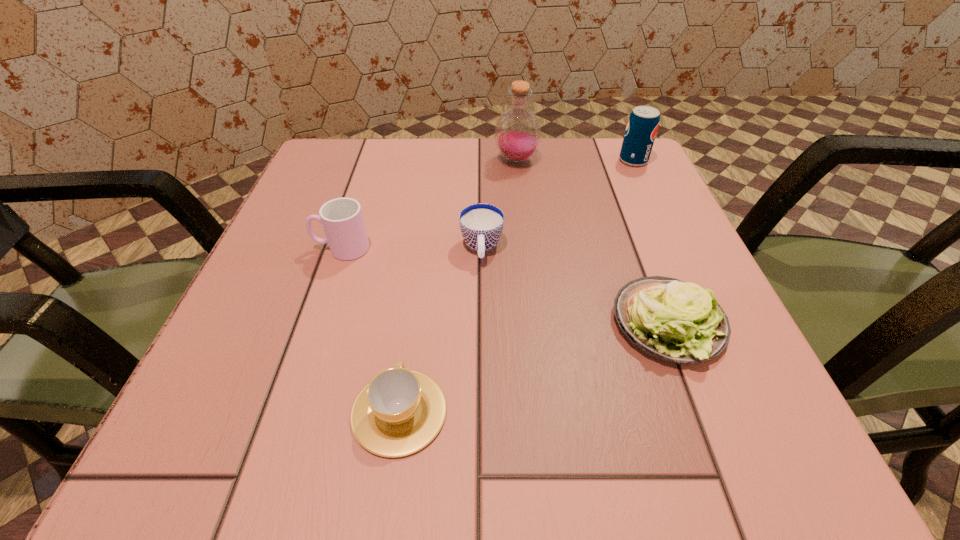
In order to click on bottle in this screenshot , I will do `click(517, 133)`.

Image resolution: width=960 pixels, height=540 pixels. I want to click on pop, so click(x=643, y=122).

At what (x,y) coordinates should I click in order to perform the action: click on the tallest cup. Please return your answer as a coordinate pair (x, y). The image size is (960, 540). Looking at the image, I should click on (342, 219).

Identify the location of the leftmost cup. This screenshot has height=540, width=960. (342, 219).

You are a GUI agent. You are given a task and a screenshot of the screen. Output one action in this format:
    pyautogui.click(x=<x>, y=<y>)
    Task: Click on the rightmost cup
    
    Given the screenshot: What is the action you would take?
    pyautogui.click(x=481, y=224)

Where is `lettuce`? The width and height of the screenshot is (960, 540). lettuce is located at coordinates (671, 320).

The width and height of the screenshot is (960, 540). What are the coordinates of `the second object from left to right` in the screenshot? It's located at (399, 412).

The height and width of the screenshot is (540, 960). I want to click on the nearest cup, so click(399, 412).

Find the location of `vacant region located 0.050m on the right of the tallest object`. vacant region located 0.050m on the right of the tallest object is located at coordinates (561, 160).

The width and height of the screenshot is (960, 540). In order to click on free space located 0.120m on the left of the pop in this screenshot , I will do click(x=564, y=160).